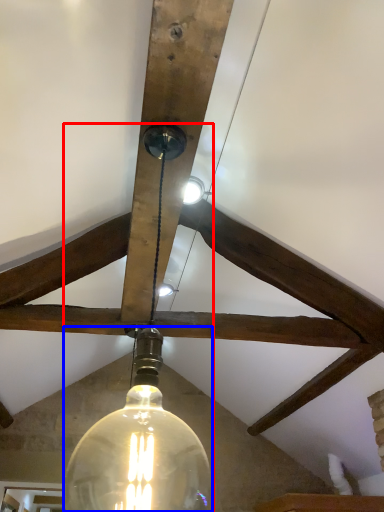
Question: Which object is further to the camera taking this photo, lamp (highlighted by a red box) or light bulb (highlighted by a blue box)?

Choices:
 (A) lamp
 (B) light bulb

Answer: (B)